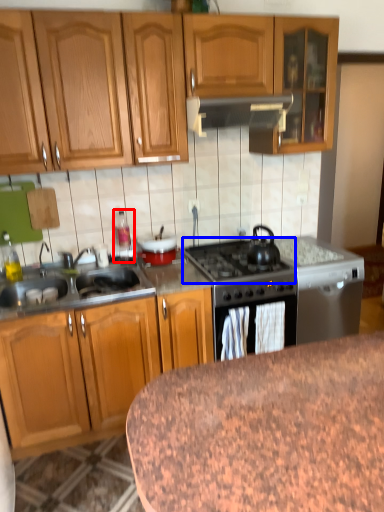
Question: Which object is closer to the camera taking this photo, appliance (highlighted by a red box) or gas stove (highlighted by a blue box)?

Choices:
 (A) appliance
 (B) gas stove

Answer: (B)